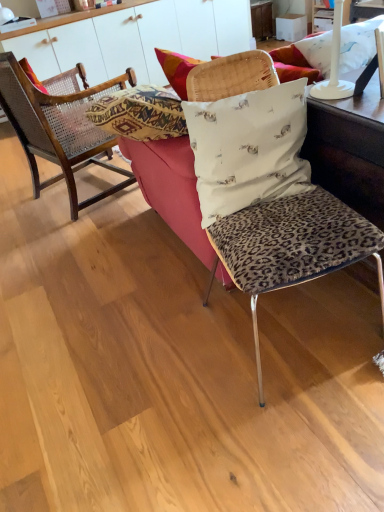
The height and width of the screenshot is (512, 384). Find the location of `free space to the left of leopard print cushion at center, the 1th chair positioned from the front`. free space to the left of leopard print cushion at center, the 1th chair positioned from the front is located at coordinates (160, 357).